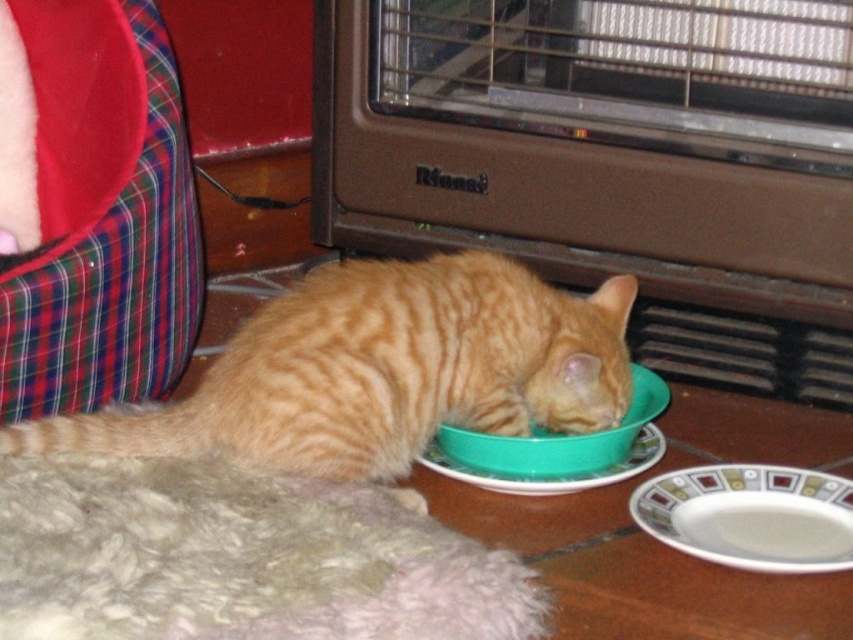
Question: Among these objects, which one is farthest from the camera?

Choices:
 (A) green plastic bowl at lower center
 (B) orange fur cat at lower left

Answer: (A)

Question: Among these points, which one is farthest from the camera?

Choices:
 (A) (323, 339)
 (B) (622, 476)
 (C) (577, 456)

Answer: (C)

Question: Does orange fur cat at lower left come in front of green plastic bowl at lower center?

Choices:
 (A) no
 (B) yes

Answer: (B)

Question: Is white glossy plate at lower right below green plastic bowl at lower center?

Choices:
 (A) yes
 (B) no

Answer: (A)

Question: Based on their relative distances, which object is nearer to the white glossy plate at lower right?

Choices:
 (A) orange fur cat at lower left
 (B) green plastic bowl at lower center
 (C) green plastic plate at lower center

Answer: (C)

Question: Is green plastic bowl at lower center closer to camera compared to green plastic plate at lower center?

Choices:
 (A) no
 (B) yes

Answer: (B)